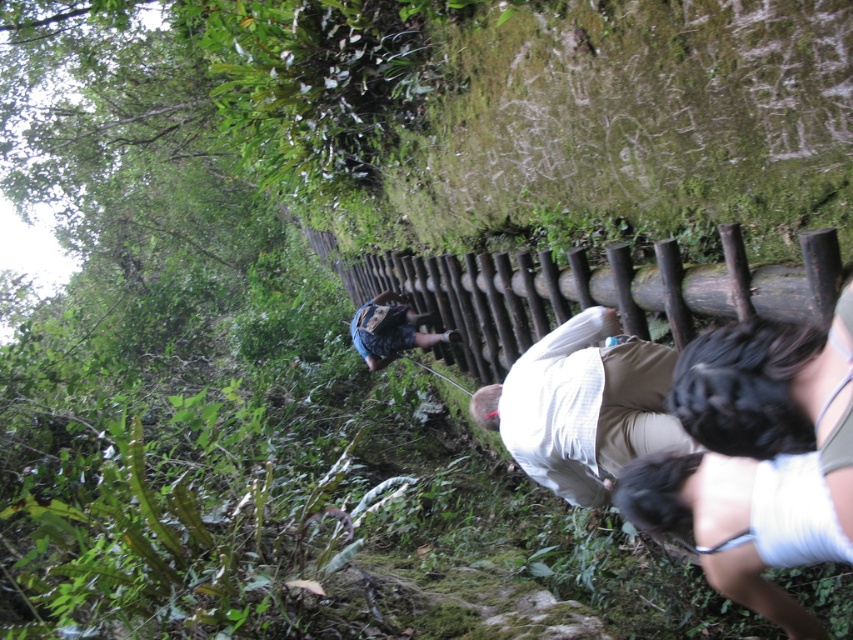
Between point (778, 504) and point (799, 243), which one is positioned in front?

Positioned in front is point (778, 504).

Can you confirm if dark brown hair at lower right is shorter than brown wooden fence at center?

Incorrect, dark brown hair at lower right's height does not fall short of brown wooden fence at center's.

Where is `dark brown hair at lower right`? dark brown hair at lower right is located at coordinates (758, 458).

Where is `brown wooden fence at center`? The width and height of the screenshot is (853, 640). brown wooden fence at center is located at coordinates (587, 291).

Is point (831, 262) farther from viewer compared to point (579, 340)?

That is False.

Where is `brown wooden fence at center`? brown wooden fence at center is located at coordinates (587, 291).

Can you confirm if white cotton shirt at center is smaller than blue denim shorts at center?

Incorrect, white cotton shirt at center is not smaller in size than blue denim shorts at center.

Can you confirm if white cotton shirt at center is taller than blue denim shorts at center?

Correct, white cotton shirt at center is much taller as blue denim shorts at center.

Who is more distant from viewer, (570, 412) or (387, 356)?

The point (387, 356) is behind.

This screenshot has width=853, height=640. Find the location of `white cotton shirt at center`. white cotton shirt at center is located at coordinates (583, 406).